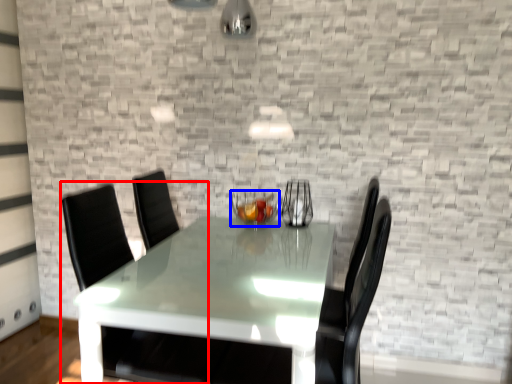
Question: Which object is closer to the camera taking this photo, swivel chair (highlighted by a red box) or candle holder (highlighted by a blue box)?

Choices:
 (A) swivel chair
 (B) candle holder

Answer: (A)